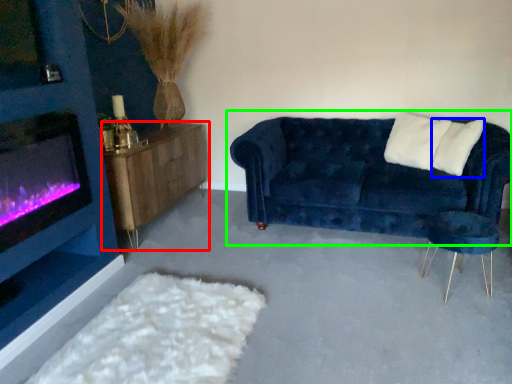
Question: Which object is the closest to the table (highlighted by a red box)? Choose among these: pillow (highlighted by a blue box) or studio couch (highlighted by a green box).

Choices:
 (A) pillow
 (B) studio couch

Answer: (B)